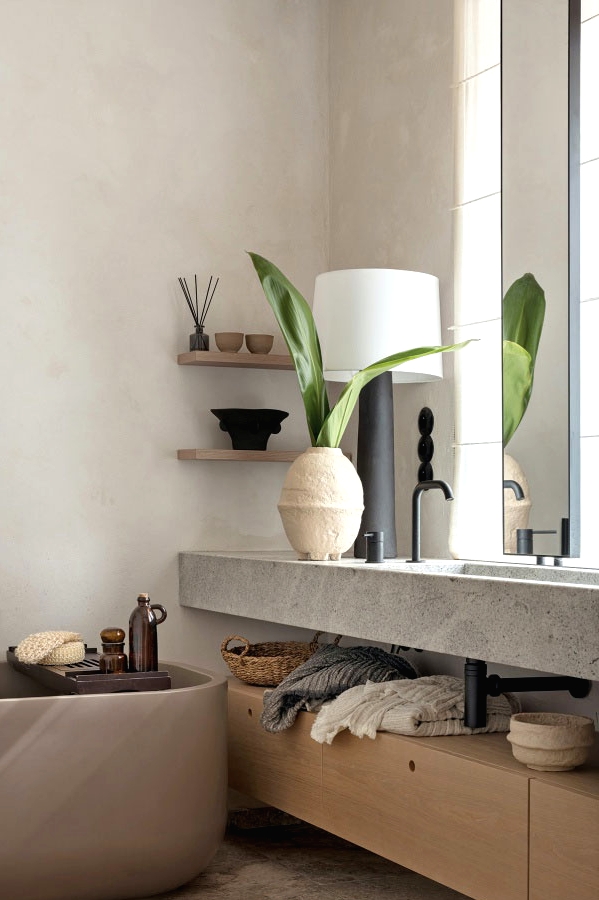
Find the location of a particular element. The image size is (599, 900). basket handles is located at coordinates (245, 645), (317, 634).